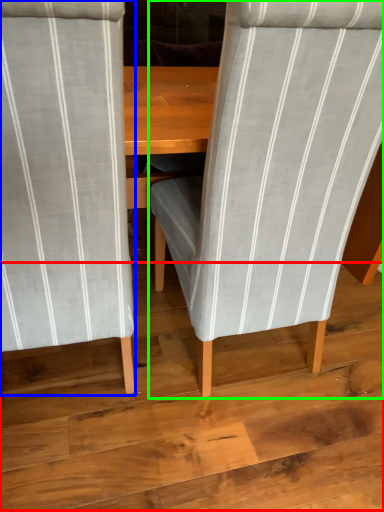
Question: Which object is the closest to the plywood (highlighted by a red box)? Choose among these: chair (highlighted by a blue box) or chair (highlighted by a green box).

Choices:
 (A) chair
 (B) chair

Answer: (B)